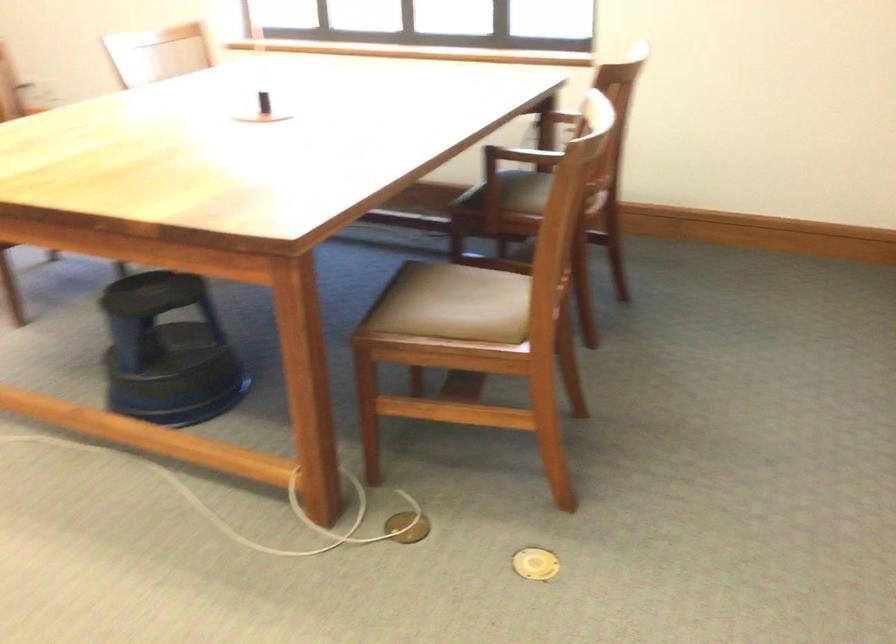
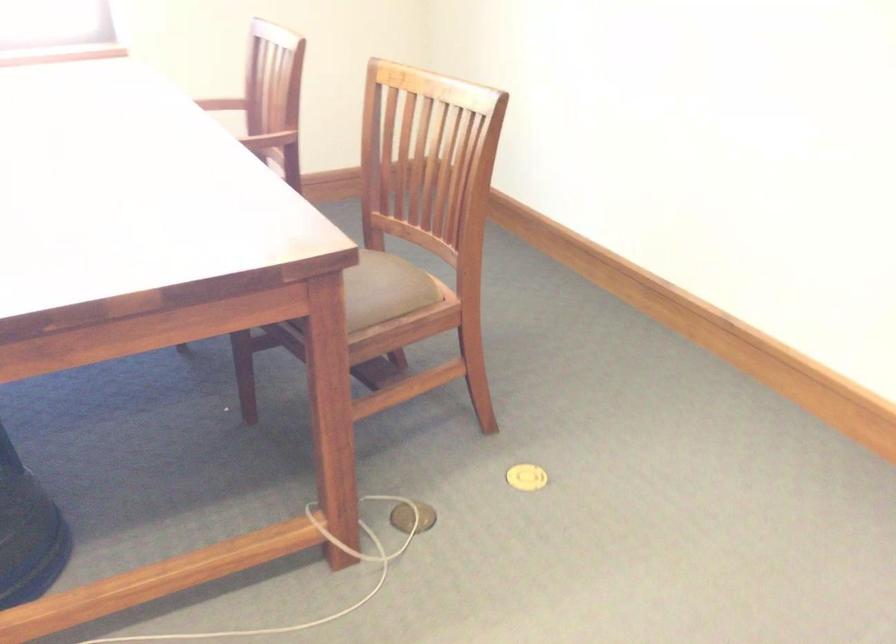
The point at (504,299) is marked in the first image. Where is the corresponding point in the second image?

(382, 274)